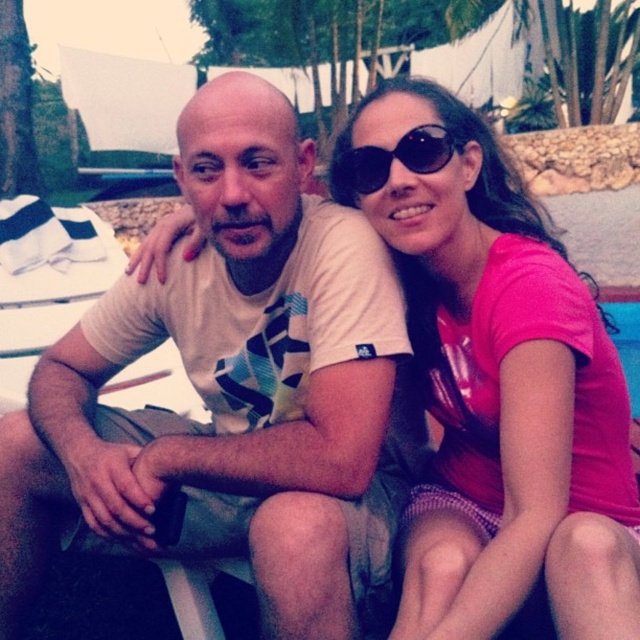
Question: Which point is farther from the camera taking this photo?

Choices:
 (A) pos(509,284)
 (B) pos(452,134)

Answer: (B)

Question: Which point appears farthest from the camera in this image?

Choices:
 (A) (493, 595)
 (B) (337, 595)
 (C) (428, 170)

Answer: (C)

Question: Is white cotton t-shirt at center positioned before pink matte shirt at center?

Choices:
 (A) yes
 (B) no

Answer: (B)

Question: Where is white cotton t-shirt at center located in relation to pink matte shirt at center in the image?

Choices:
 (A) right
 (B) left

Answer: (B)

Question: Which point is closer to the camera?

Choices:
 (A) white cotton t-shirt at center
 (B) black plastic sunglasses at upper center

Answer: (A)

Question: Observing the image, what is the correct spatial positioning of white cotton t-shirt at center in reference to pink matte shirt at center?

Choices:
 (A) above
 (B) below

Answer: (B)